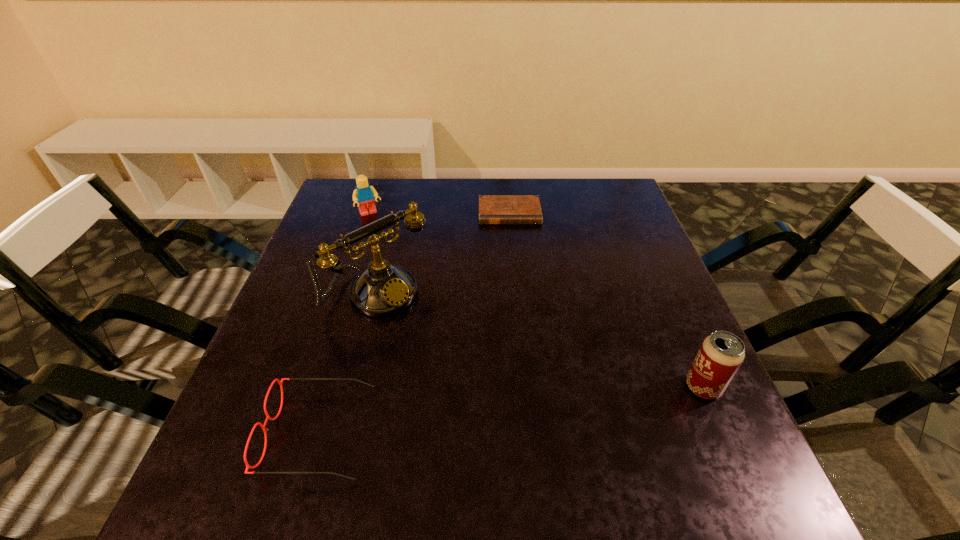
The width and height of the screenshot is (960, 540). What are the coordinates of `object present at the near edge` in the screenshot? It's located at (248, 466).

Locate an element on the screen. The width and height of the screenshot is (960, 540). spectacles that is at the left edge is located at coordinates (248, 466).

Locate an element on the screen. The image size is (960, 540). telephone located at the left edge is located at coordinates (383, 289).

This screenshot has height=540, width=960. In order to click on Lego located in the left edge section of the desktop in this screenshot , I will do `click(363, 195)`.

The height and width of the screenshot is (540, 960). I want to click on object present at the right edge, so click(722, 353).

You are a GUI agent. You are given a task and a screenshot of the screen. Output one action in this format:
    pyautogui.click(x=<x>, y=<y>)
    Task: Click on the object present at the far left corner
    
    Given the screenshot: What is the action you would take?
    pyautogui.click(x=363, y=195)

Find the location of a particular element. The image size is (960, 540). object that is at the near left corner is located at coordinates (248, 466).

Where is `vacant space at the near edge of the desktop`? This screenshot has width=960, height=540. vacant space at the near edge of the desktop is located at coordinates (505, 408).

I want to click on free space at the left edge of the desktop, so click(337, 235).

Image resolution: width=960 pixels, height=540 pixels. What are the coordinates of `vacant space at the right edge of the desktop` in the screenshot? It's located at (671, 298).